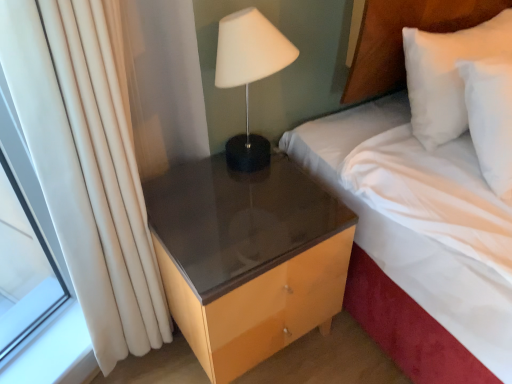
Question: Is white matte lamp at upper right positioned with its back to glossy wood nightstand at lower right?

Choices:
 (A) yes
 (B) no

Answer: (B)

Question: Is white matte lamp at upper right at the right side of glossy wood nightstand at lower right?

Choices:
 (A) yes
 (B) no

Answer: (A)

Question: Is glossy wood nightstand at lower right located within white matte lamp at upper right?

Choices:
 (A) no
 (B) yes

Answer: (A)

Question: Does white matte lamp at upper right turn towards glossy wood nightstand at lower right?

Choices:
 (A) yes
 (B) no

Answer: (B)

Question: From the image's perspective, is white matte lamp at upper right located beneath glossy wood nightstand at lower right?

Choices:
 (A) no
 (B) yes

Answer: (A)

Question: From a real-world perspective, relative to white fabric bed at upper right, is glossy wood nightstand at lower right vertically above or below?

Choices:
 (A) below
 (B) above

Answer: (A)

Question: Is glossy wood nightstand at lower right wider or thinner than white fabric bed at upper right?

Choices:
 (A) thin
 (B) wide

Answer: (A)

Question: In terms of size, does glossy wood nightstand at lower right appear bigger or smaller than white fabric bed at upper right?

Choices:
 (A) big
 (B) small

Answer: (B)

Question: From the image's perspective, is glossy wood nightstand at lower right above or below white fabric bed at upper right?

Choices:
 (A) below
 (B) above

Answer: (A)

Question: Looking at the image, does white matte lamp at upper right seem bigger or smaller compared to white soft pillow at upper right?

Choices:
 (A) big
 (B) small

Answer: (B)

Question: Considering the positions of white matte lamp at upper right and white soft pillow at upper right in the image, is white matte lamp at upper right wider or thinner than white soft pillow at upper right?

Choices:
 (A) thin
 (B) wide

Answer: (A)

Question: Considering the positions of point (226, 62) and point (458, 31), is point (226, 62) closer or farther from the camera than point (458, 31)?

Choices:
 (A) farther
 (B) closer

Answer: (B)

Question: From their relative heights in the image, would you say white matte lamp at upper right is taller or shorter than white soft pillow at upper right?

Choices:
 (A) short
 (B) tall

Answer: (A)

Question: Do you think white soft pillow at upper right is within white fabric bed at upper right, or outside of it?

Choices:
 (A) outside
 (B) inside

Answer: (B)

Question: Considering the positions of point (451, 132) and point (421, 372), is point (451, 132) closer or farther from the camera than point (421, 372)?

Choices:
 (A) closer
 (B) farther

Answer: (B)